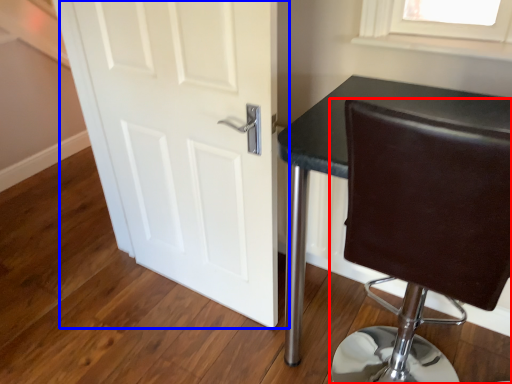
Question: Which object is further to the camera taking this photo, chair (highlighted by a red box) or door (highlighted by a blue box)?

Choices:
 (A) chair
 (B) door

Answer: (B)